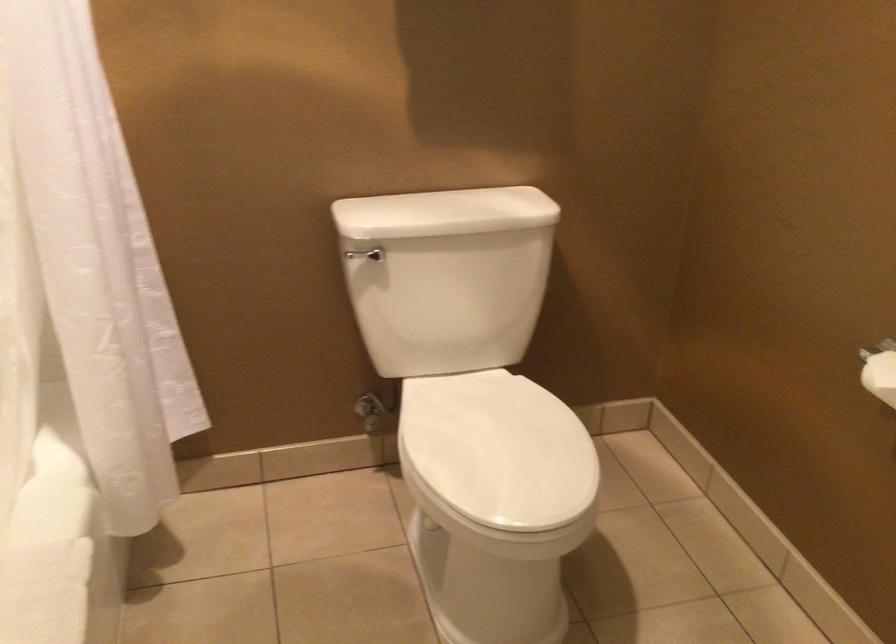
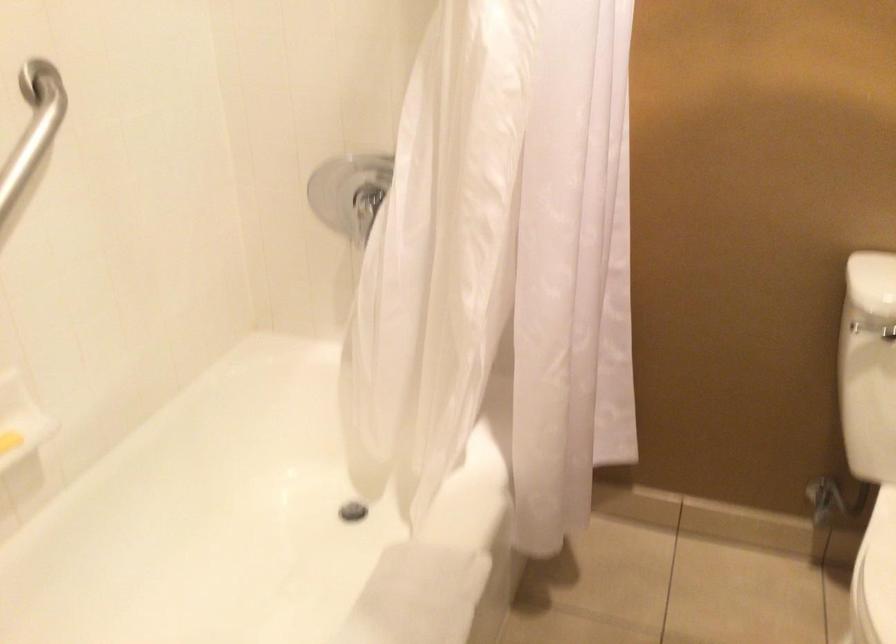
Question: The first image is from the beginning of the video and the second image is from the end. How did the camera likely rotate when shooting the video?

Choices:
 (A) Left
 (B) Right
 (C) Up
 (D) Down

Answer: (A)